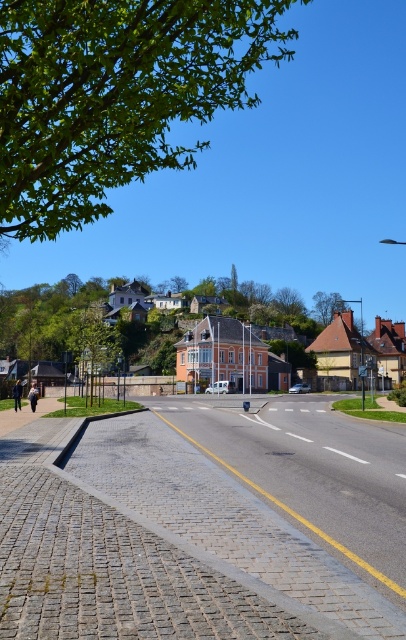
Question: Which point appears farthest from the camera in this image?

Choices:
 (A) (54, 321)
 (B) (362, 406)

Answer: (A)

Question: Can you confirm if green leafy tree at upper left is smaller than metallic rectangular sign at center-right?

Choices:
 (A) no
 (B) yes

Answer: (A)

Question: Does orange painted building at upper center appear on the right side of green plastic street sign at center?

Choices:
 (A) no
 (B) yes

Answer: (A)

Question: Estimate the real-world distances between objects in this image. Which object is closer to the metallic rectangular sign at center-right?

Choices:
 (A) orange painted building at upper center
 (B) green leafy tree at upper left
 (C) green leafy tree at upper center

Answer: (A)

Question: Based on their relative distances, which object is farther from the green leafy tree at upper left?

Choices:
 (A) green leafy tree at upper center
 (B) orange painted building at upper center
 (C) green plastic street sign at center
 (D) metallic rectangular sign at center-right

Answer: (D)

Question: Is green leafy tree at upper center bigger than metallic rectangular sign at center-right?

Choices:
 (A) yes
 (B) no

Answer: (A)